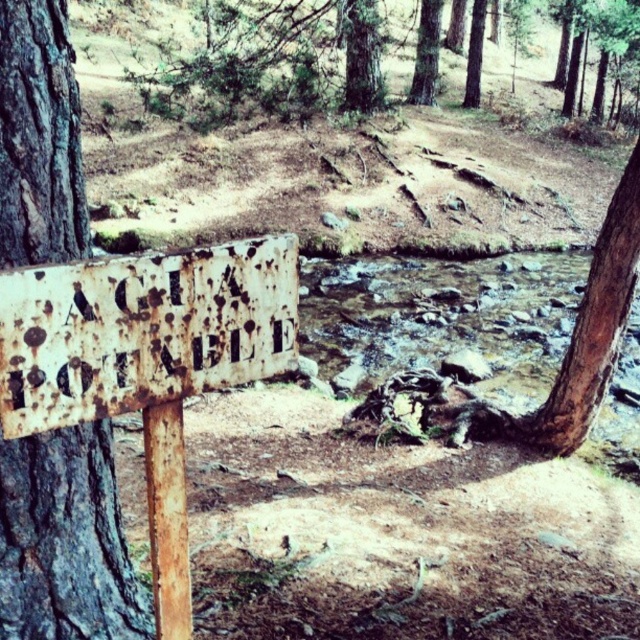
You are a hiker who wants to locate the rusty wood post at lower left and the green rough bark tree at upper center. According to the scene, which object is positioned more to the east?

The rusty wood post at lower left is to the left of green rough bark tree at upper center, so the rusty wood post at lower left is positioned more to the east.

You are a hiker who needs to cross the stream to reach the rusty wood post at lower left. The stream is 1.94 meters wide. Your backpack has a 2.0 meter long rope. Can you safely use the rope to cross the stream?

The stream is 1.94 meters wide, and the rope is 2.0 meters long. Since the rope is longer than the stream width, you can safely use it to cross the stream to reach the rusty wood post at lower left.

Based on the photo, you are an explorer navigating a forest and come across the scene. You need to determine which object is smaller between the rusty wood post at lower left and the green rough bark tree at upper center. Can you identify it?

The rusty wood post at lower left is smaller than the green rough bark tree at upper center.